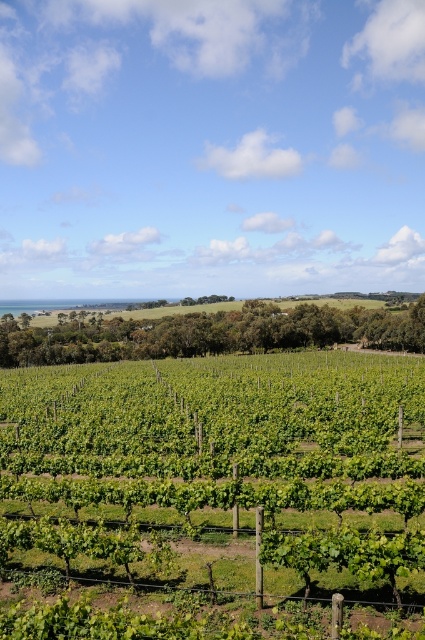
You are standing in the vineyard looking towards the midground. Which object is positioned lower in the scene, the green leafy vines at center or the green grassy hillside at center?

The green leafy vines at center are positioned below the green grassy hillside at center, so the green leafy vines at center are lower in the scene.